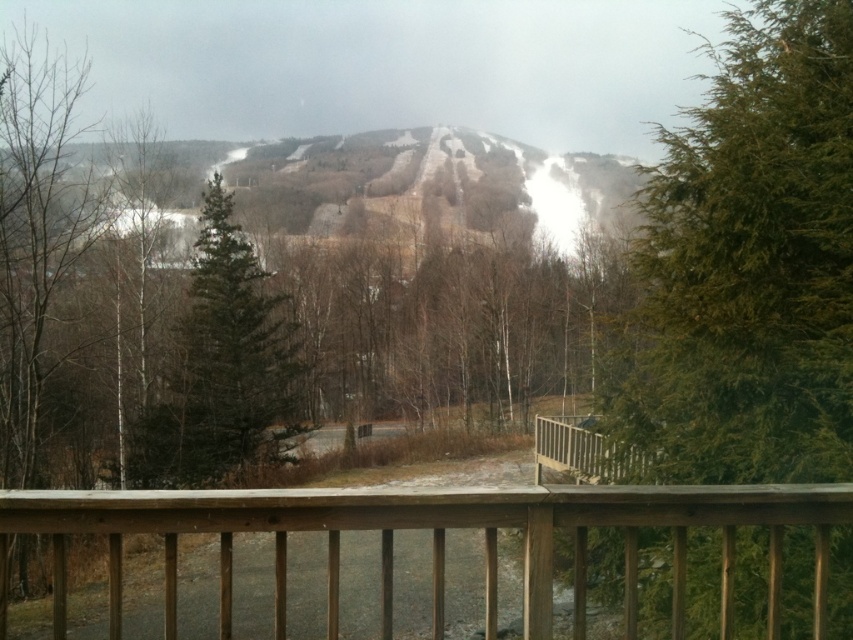
Question: Which of the following is the closest to the observer?

Choices:
 (A) (766, 508)
 (B) (689, 458)

Answer: (A)

Question: Considering the real-world distances, which object is closest to the green needle-like tree at right?

Choices:
 (A) brown wooden railing at center
 (B) green matte tree at center

Answer: (A)

Question: Can you confirm if green needle-like tree at right is bigger than brown wooden railing at center?

Choices:
 (A) yes
 (B) no

Answer: (A)

Question: In this image, where is green needle-like tree at right located relative to brown wooden railing at center?

Choices:
 (A) right
 (B) left

Answer: (A)

Question: Among these objects, which one is nearest to the camera?

Choices:
 (A) green matte tree at center
 (B) green needle-like tree at right

Answer: (B)

Question: Can you confirm if green needle-like tree at right is positioned below green matte tree at center?

Choices:
 (A) yes
 (B) no

Answer: (B)